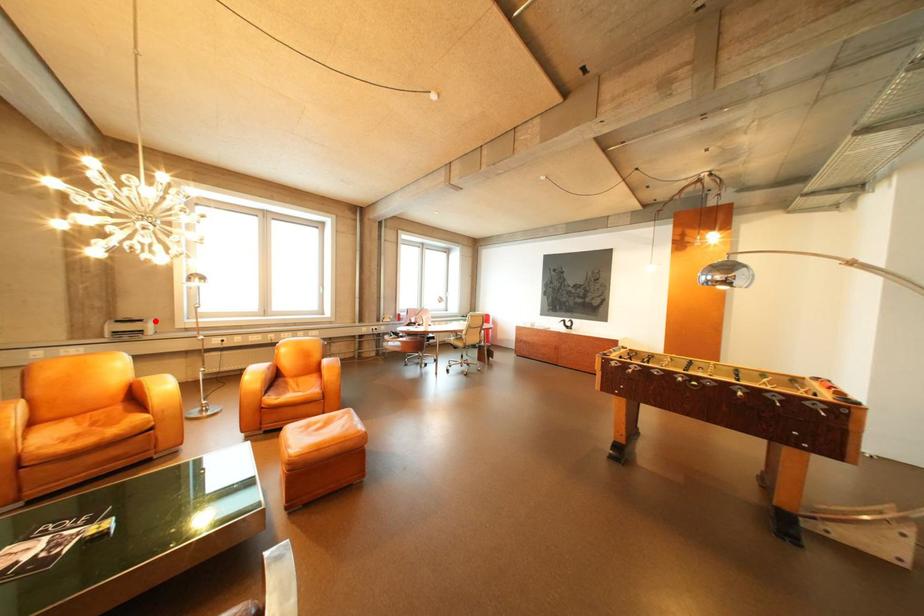
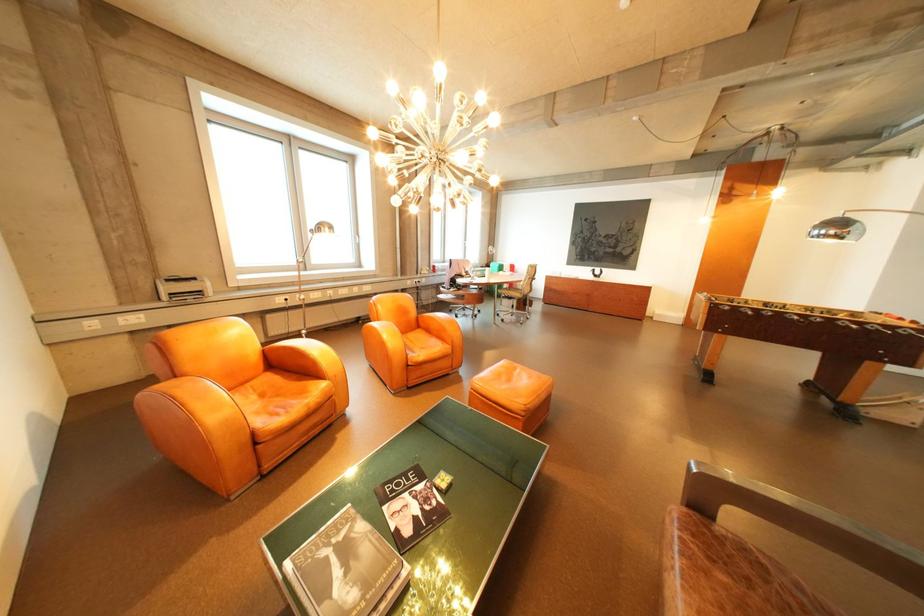
Question: I am providing you with two images of the same scene from different viewpoints. A red point is marked on the first image. Can you still see the location of the red point in image 2?

Choices:
 (A) Yes
 (B) No

Answer: (A)